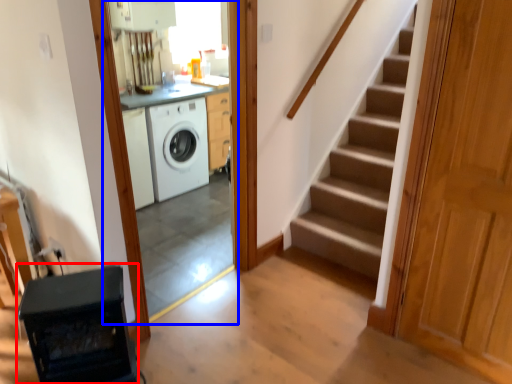
Question: Which of the following is the closest to the observer, appliance (highlighted by a red box) or screen door (highlighted by a blue box)?

Choices:
 (A) appliance
 (B) screen door

Answer: (A)